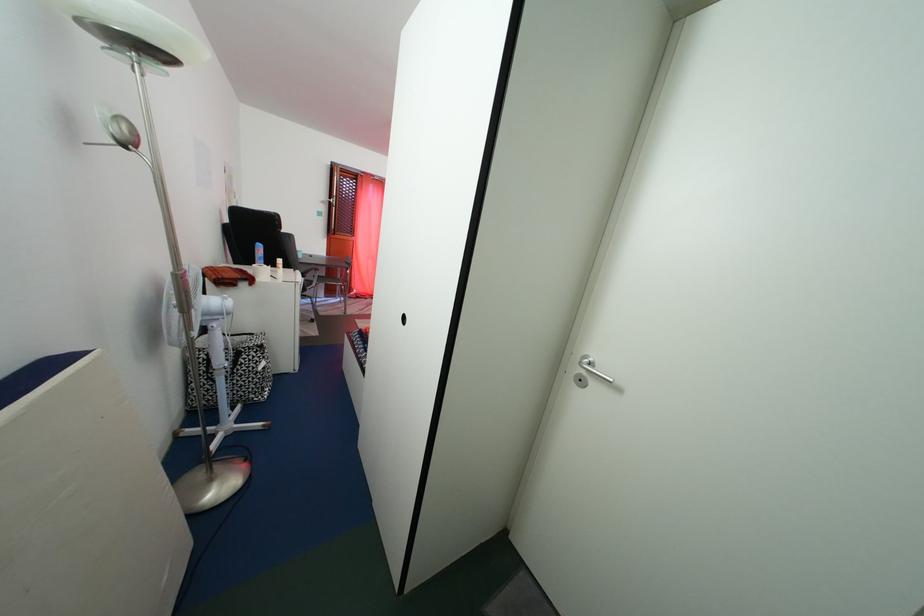
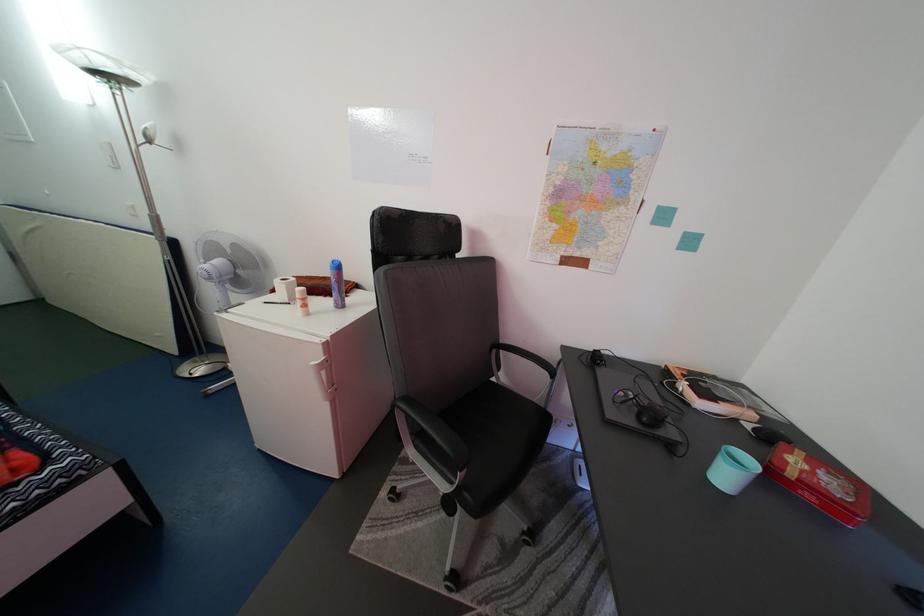
Where in the second image is the point corresponding to point 309,262 from the first image?

(735, 484)